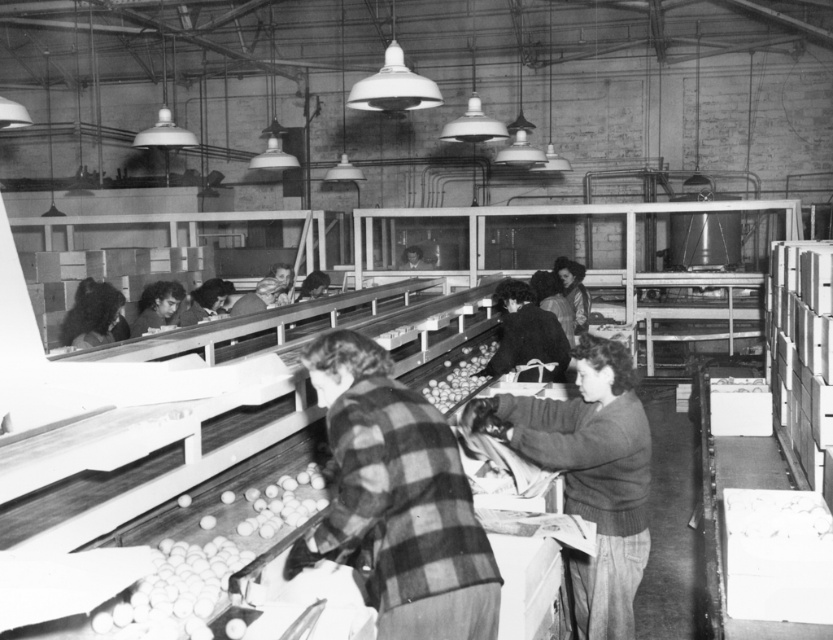
Question: From the image, what is the correct spatial relationship of dark brown sweater at center in relation to dark brown hair at left?

Choices:
 (A) right
 (B) left

Answer: (A)

Question: Considering the relative positions of dark brown hair at left and smooth brown potatoes at center in the image provided, where is dark brown hair at left located with respect to smooth brown potatoes at center?

Choices:
 (A) left
 (B) right

Answer: (A)

Question: Among these objects, which one is farthest from the camera?

Choices:
 (A) dark brown hair at left
 (B) plaid shirt at center
 (C) dark brown sweater at center

Answer: (B)

Question: Considering the real-world distances, which object is farthest from the smooth brown potatoes at center?

Choices:
 (A) checkered fabric shirt at center
 (B) dark brown sweater at center

Answer: (A)

Question: Among these objects, which one is nearest to the camera?

Choices:
 (A) smooth brown potatoes at center
 (B) dark brown sweater at center
 (C) plaid shirt at center

Answer: (B)

Question: Is checkered fabric shirt at center smaller than smooth brown potatoes at center?

Choices:
 (A) yes
 (B) no

Answer: (A)